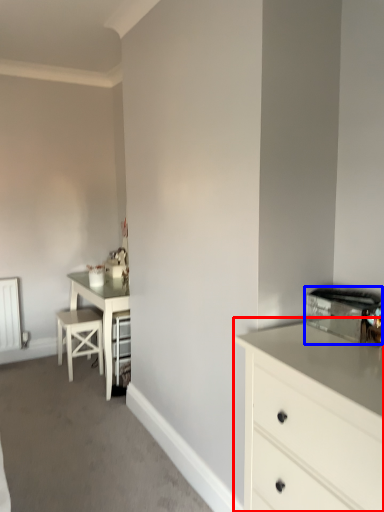
Question: Which of the following is the closest to the observer, chest of drawers (highlighted by a red box) or appliance (highlighted by a blue box)?

Choices:
 (A) chest of drawers
 (B) appliance

Answer: (A)